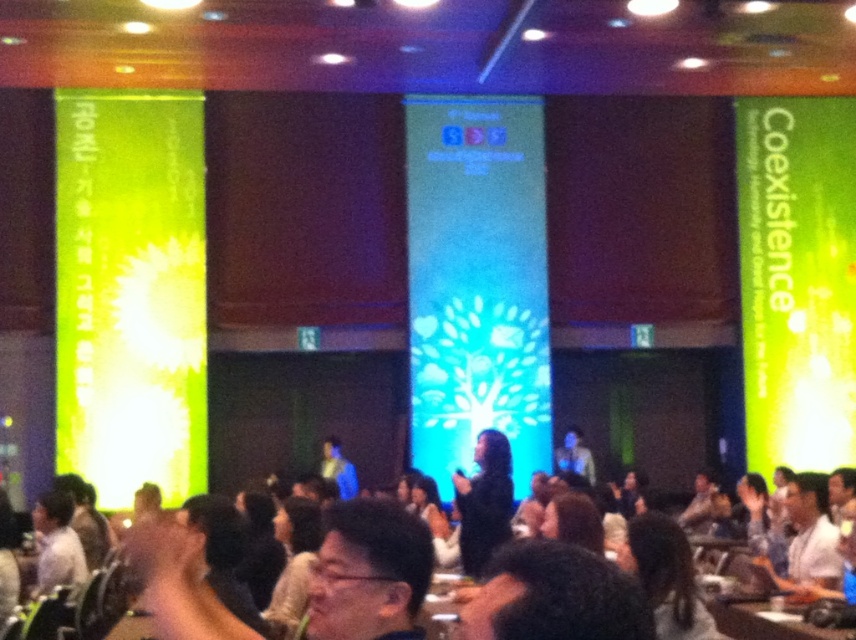
You are at a conference and see a person with dark hair at center and a black matte dress at center. From the perspective of someone facing the person, which object is on the left?

The dark hair at center is to the left of the black matte dress at center from the perspective of someone facing the person.

You are a photographer at the event and want to capture a clear shot of the dark hair at center and the black matte dress at center. Which object should you focus on to ensure it appears larger in the photo?

The dark hair at center is bigger than the black matte dress at center, so focusing on the dark hair at center will ensure it appears larger in the photo.